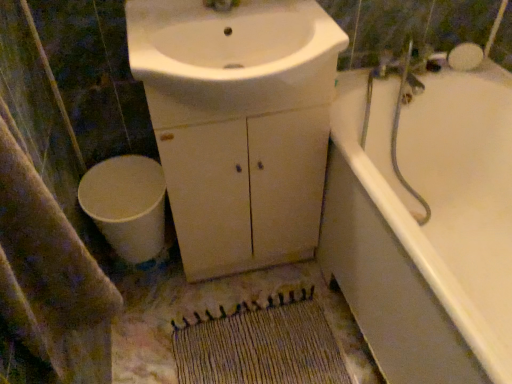
Identify the location of free point below woven beige mat at lower center (from a real-world perspective). click(258, 347).